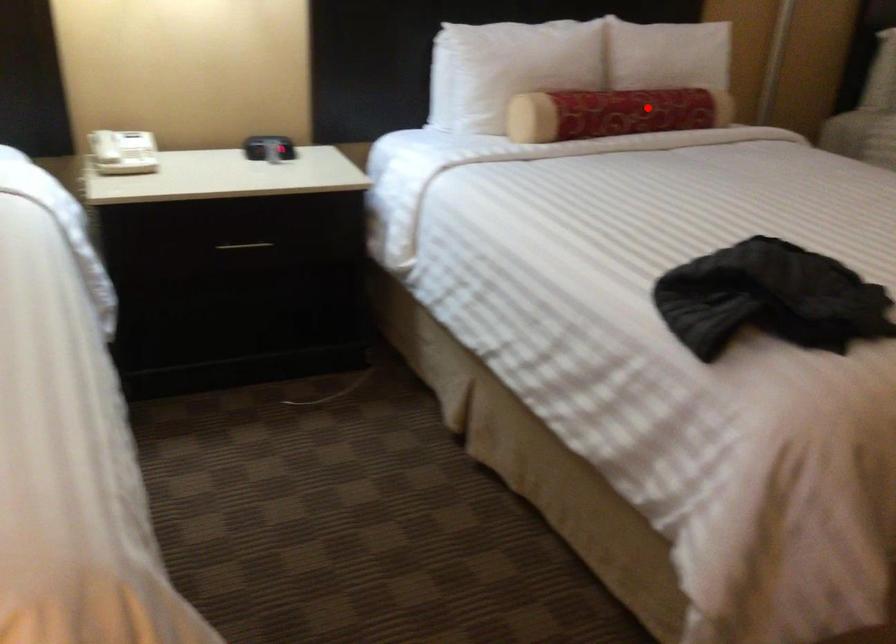
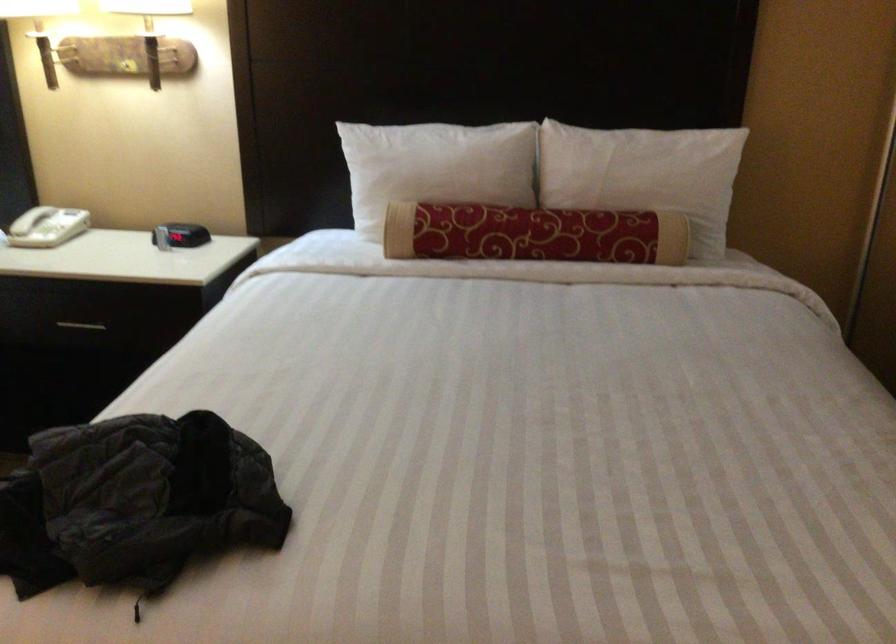
The point at the highlighted location is marked in the first image. Where is the corresponding point in the second image?

(533, 234)